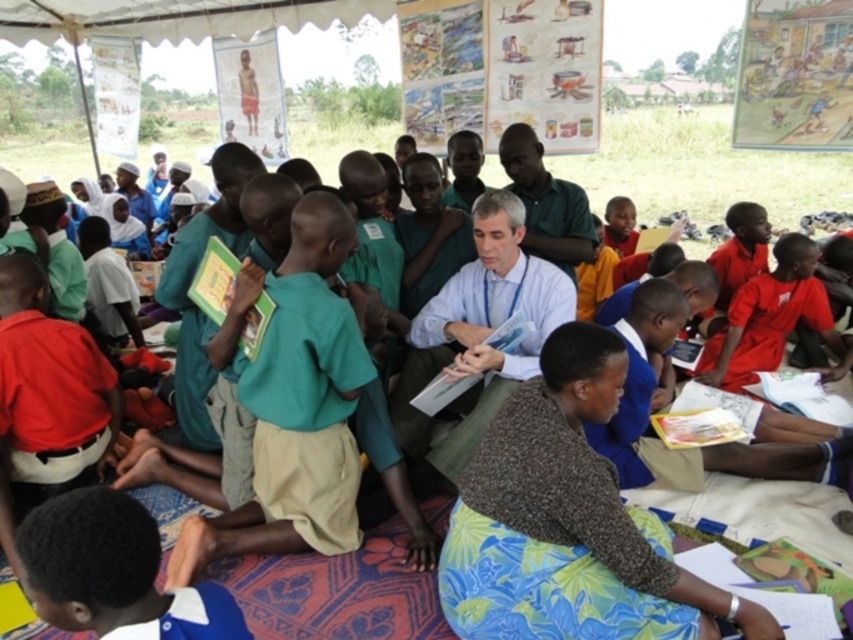
The height and width of the screenshot is (640, 853). Describe the element at coordinates (479, 333) in the screenshot. I see `light blue shirt at center` at that location.

Looking at this image, how much distance is there between light blue shirt at center and green fabric shirt at center?

18.99 inches

Is point (473, 404) in front of point (552, 193)?

Yes, point (473, 404) is in front of point (552, 193).

In order to click on light blue shirt at center in this screenshot , I will do `click(479, 333)`.

Is point (808, 276) positioned before point (538, 230)?

No, it is behind (538, 230).

Which is more to the left, red cotton shirt at right or green fabric shirt at center?

green fabric shirt at center is more to the left.

Is point (763, 358) farther from viewer compared to point (523, 160)?

That is True.

At what (x,y) coordinates should I click in order to perform the action: click on red cotton shirt at right. Please return your answer as a coordinate pair (x, y). Looking at the image, I should click on (769, 317).

Is point (529, 280) closer to viewer compared to point (813, 289)?

Yes, it is in front of point (813, 289).

Who is positioned more to the right, light blue shirt at center or red cotton shirt at right?

red cotton shirt at right

Is point (506, 296) positioned behind point (785, 288)?

No, (506, 296) is in front of (785, 288).

I want to click on light blue shirt at center, so click(479, 333).